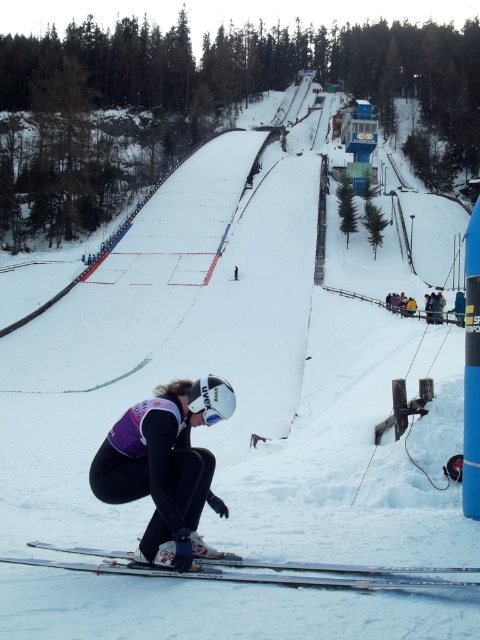
What do you see at coordinates (262, 570) in the screenshot? I see `white glossy skis at lower center` at bounding box center [262, 570].

Which is above, white glossy skis at lower center or yellow fabric jacket at right?

yellow fabric jacket at right

Find the location of a particular element. white glossy skis at lower center is located at coordinates (262, 570).

Identify the location of white glossy skis at lower center. The height and width of the screenshot is (640, 480). (262, 570).

Can you confirm if matte purple ski suit at lower center is positioned above white glossy skis at lower center?

Indeed, matte purple ski suit at lower center is positioned over white glossy skis at lower center.

Who is more forward, (123, 432) or (87, 547)?

Point (123, 432)

Find the location of a particular element. Image resolution: width=480 pixels, height=640 pixels. matte purple ski suit at lower center is located at coordinates (166, 465).

From the picture: Is matte purple ski suit at lower center bigger than yellow fabric jacket at right?

No.

Consider the image. Is matte purple ski suit at lower center below yellow fabric jacket at right?

Yes, matte purple ski suit at lower center is below yellow fabric jacket at right.

I want to click on matte purple ski suit at lower center, so click(x=166, y=465).

Where is `matte purple ski suit at lower center`? The width and height of the screenshot is (480, 640). matte purple ski suit at lower center is located at coordinates (166, 465).